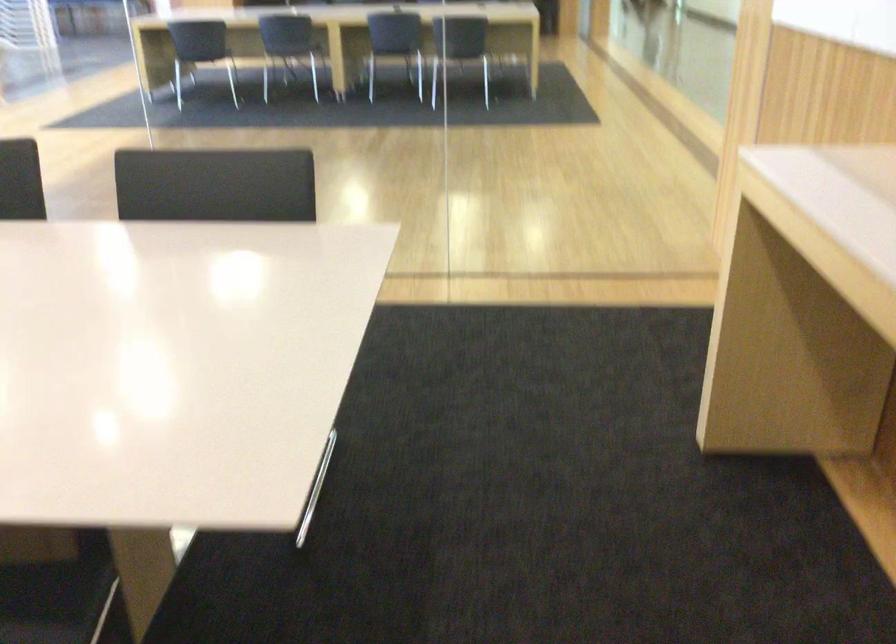
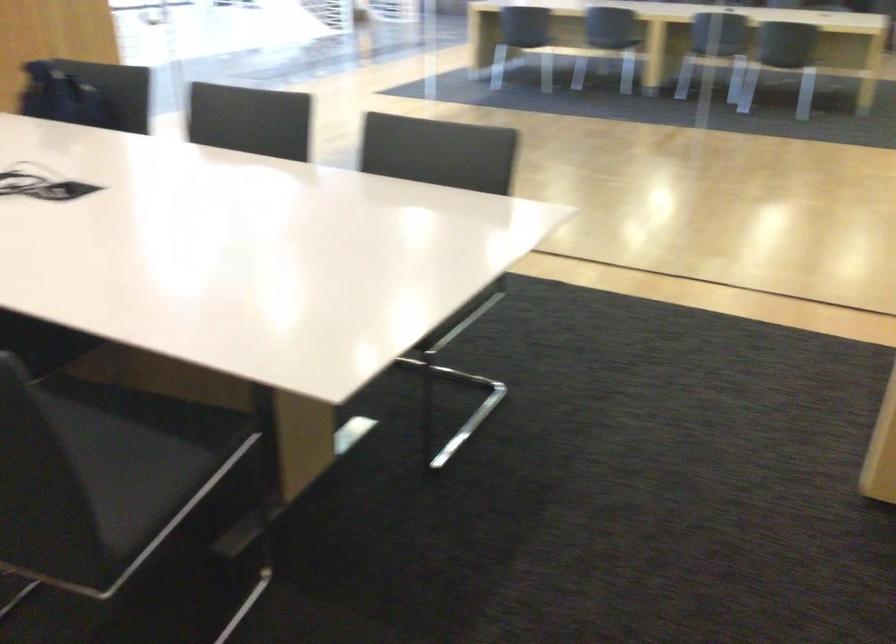
Question: What movement of the cameraman would produce the second image?

Choices:
 (A) Left
 (B) Right
 (C) Forward
 (D) Backward

Answer: (B)